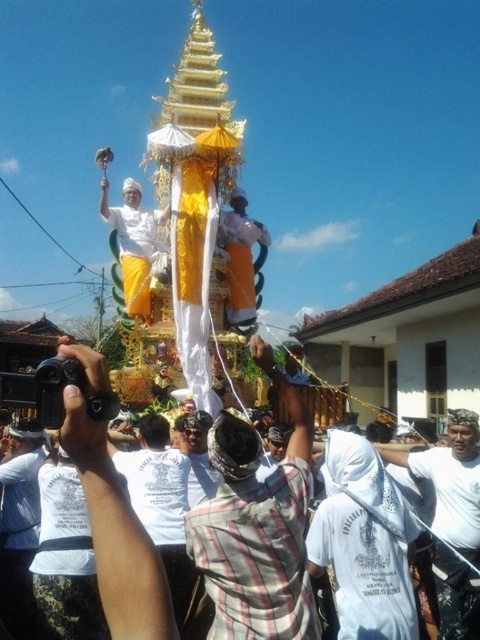
You are a photographer at the event and want to capture both the plaid shirt at center and the white woven cloth at center in a single shot. Which object should you focus on first to ensure both are in frame?

The plaid shirt at center is taller than the white woven cloth at center, so you should focus on the plaid shirt at center first to ensure both are in frame.

You are standing at point (256,528) in the image. What is the nearest object to you?

The nearest object to you at point (256,528) is the plaid shirt at center.